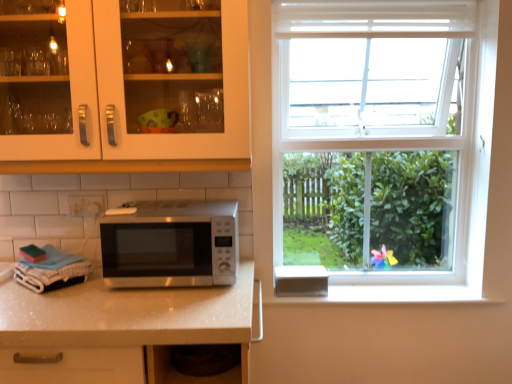
Question: From their relative heights in the image, would you say matte white cabinet at upper left is taller or shorter than satin silver microwave at center?

Choices:
 (A) tall
 (B) short

Answer: (A)

Question: From the image's perspective, relative to satin silver microwave at center, is matte white cabinet at upper left above or below?

Choices:
 (A) below
 (B) above

Answer: (B)

Question: In terms of width, does matte white cabinet at upper left look wider or thinner when compared to satin silver microwave at center?

Choices:
 (A) thin
 (B) wide

Answer: (A)

Question: Is satin silver microwave at center bigger or smaller than matte white cabinet at upper left?

Choices:
 (A) small
 (B) big

Answer: (A)

Question: Is satin silver microwave at center inside the boundaries of matte white cabinet at upper left, or outside?

Choices:
 (A) outside
 (B) inside

Answer: (A)

Question: Considering the positions of point (229, 215) and point (49, 170), is point (229, 215) closer or farther from the camera than point (49, 170)?

Choices:
 (A) farther
 (B) closer

Answer: (B)

Question: Looking at their shapes, would you say satin silver microwave at center is wider or thinner than matte white cabinet at upper left?

Choices:
 (A) wide
 (B) thin

Answer: (A)